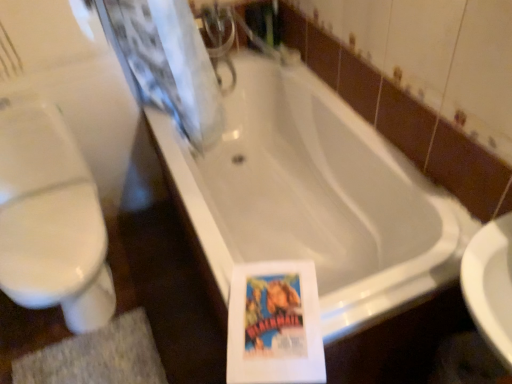
The image size is (512, 384). In order to click on vacant space to the right of white glossy toilet at left in this screenshot , I will do `click(172, 289)`.